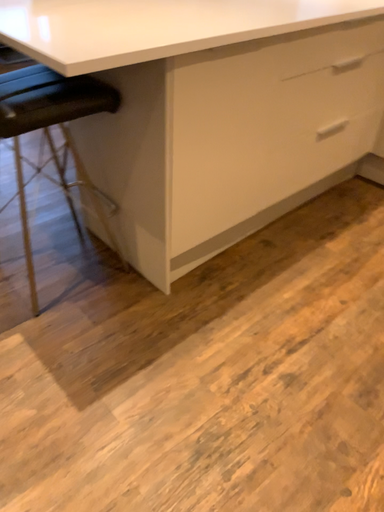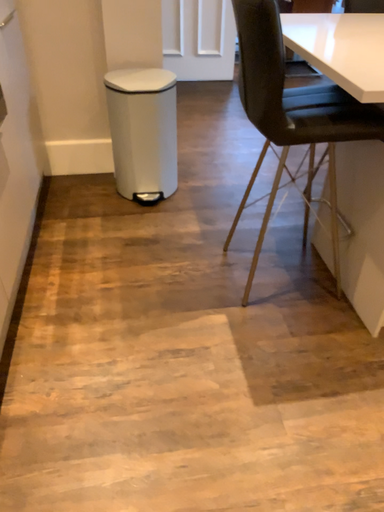
Question: How did the camera likely rotate when shooting the video?

Choices:
 (A) rotated right
 (B) rotated left

Answer: (B)